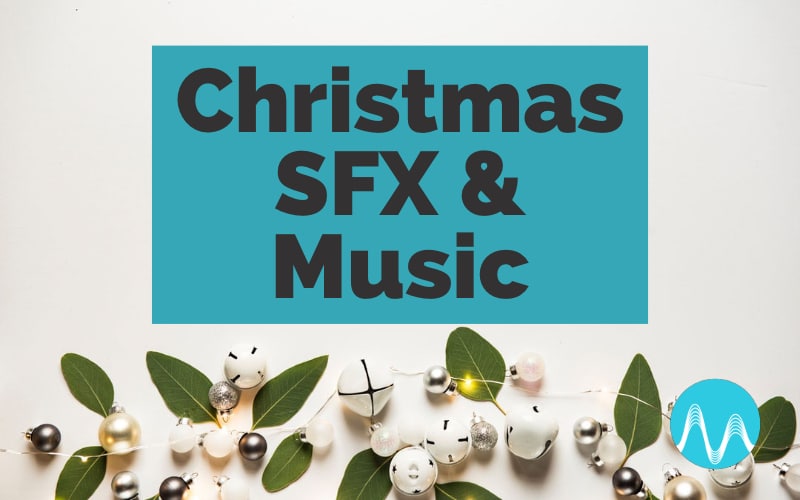
Where is `box`? box is located at coordinates (201, 195).